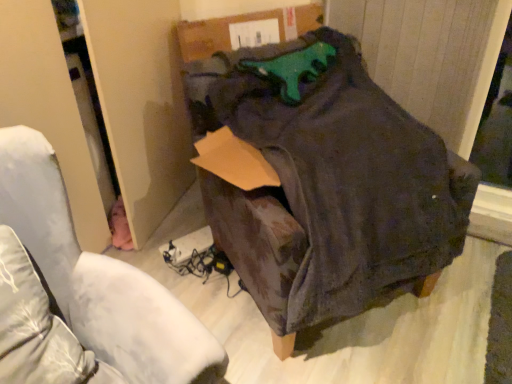
Question: From the image's perspective, is dark fabric bag at center located above or below dark gray suede bean bag chair at center?

Choices:
 (A) above
 (B) below

Answer: (B)

Question: Do you think dark fabric bag at center is within dark gray suede bean bag chair at center, or outside of it?

Choices:
 (A) inside
 (B) outside

Answer: (B)

Question: Considering the positions of dark fabric bag at center and dark gray suede bean bag chair at center in the image, is dark fabric bag at center wider or thinner than dark gray suede bean bag chair at center?

Choices:
 (A) wide
 (B) thin

Answer: (B)

Question: Would you say dark gray suede bean bag chair at center is to the left or to the right of dark fabric bag at center in the picture?

Choices:
 (A) right
 (B) left

Answer: (A)

Question: Would you say dark gray suede bean bag chair at center is inside or outside dark fabric bag at center?

Choices:
 (A) inside
 (B) outside

Answer: (B)

Question: From the image's perspective, is dark gray suede bean bag chair at center located above or below dark fabric bag at center?

Choices:
 (A) below
 (B) above

Answer: (B)

Question: Considering their positions, is dark gray suede bean bag chair at center located in front of or behind dark fabric bag at center?

Choices:
 (A) behind
 (B) front

Answer: (A)